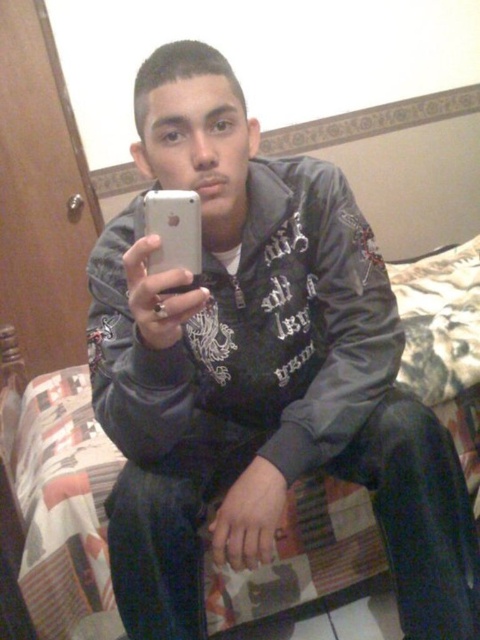
Question: Considering the real-world distances, which object is closest to the matte black leather jacket at center?

Choices:
 (A) silver metallic phone at center
 (B) plaid fabric bed at center

Answer: (A)

Question: Can you confirm if plaid fabric bed at center is positioned to the left of silver metallic phone at center?

Choices:
 (A) yes
 (B) no

Answer: (A)

Question: Estimate the real-world distances between objects in this image. Which object is closer to the silver metallic phone at center?

Choices:
 (A) plaid fabric bed at center
 (B) matte black leather jacket at center

Answer: (B)

Question: Is plaid fabric bed at center closer to the viewer compared to silver metallic phone at center?

Choices:
 (A) no
 (B) yes

Answer: (A)

Question: Can you confirm if matte black leather jacket at center is thinner than plaid fabric bed at center?

Choices:
 (A) no
 (B) yes

Answer: (A)

Question: Which of the following is the closest to the observer?

Choices:
 (A) (408, 339)
 (B) (259, 262)

Answer: (B)